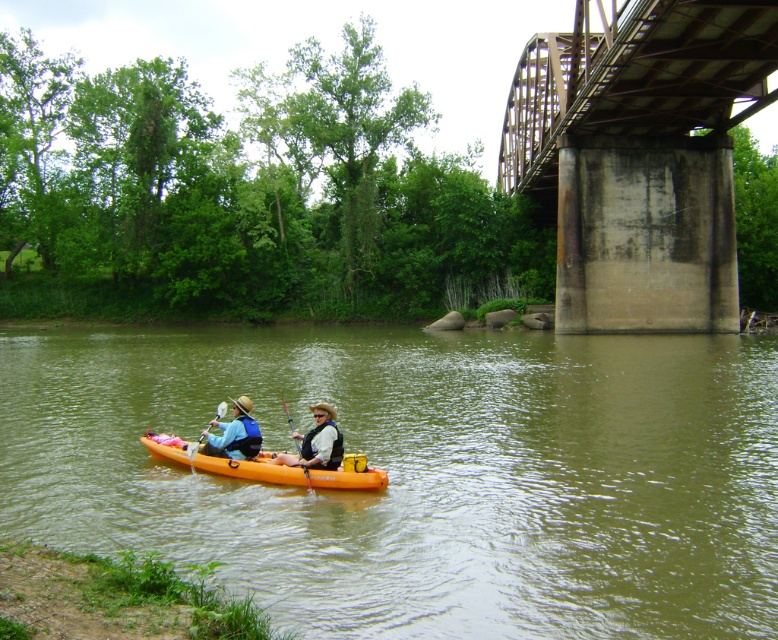
Can you confirm if matte blue life vest at center is taller than wooden paddle at center?

In fact, matte blue life vest at center may be shorter than wooden paddle at center.

Can you confirm if matte blue life vest at center is positioned below wooden paddle at center?

Actually, matte blue life vest at center is above wooden paddle at center.

Where is `matte blue life vest at center`? The height and width of the screenshot is (640, 778). matte blue life vest at center is located at coordinates (233, 435).

Image resolution: width=778 pixels, height=640 pixels. I want to click on matte blue life vest at center, so click(x=233, y=435).

Is white matte life vest at center positioned in front of wooden textured paddle at center?

That is True.

Can you confirm if white matte life vest at center is positioned above wooden textured paddle at center?

Yes.

Is point (324, 410) closer to camera compared to point (300, 452)?

Yes, it is.

At what (x,y) coordinates should I click in order to perform the action: click on white matte life vest at center. Please return your answer as a coordinate pair (x, y). This screenshot has width=778, height=640. Looking at the image, I should click on (316, 442).

Does orange plastic kayak at center appear on the left side of matte blue life vest at center?

Incorrect, orange plastic kayak at center is not on the left side of matte blue life vest at center.

Does orange plastic kayak at center have a smaller size compared to matte blue life vest at center?

Incorrect, orange plastic kayak at center is not smaller in size than matte blue life vest at center.

The image size is (778, 640). In order to click on orange plastic kayak at center in this screenshot , I will do `click(421, 474)`.